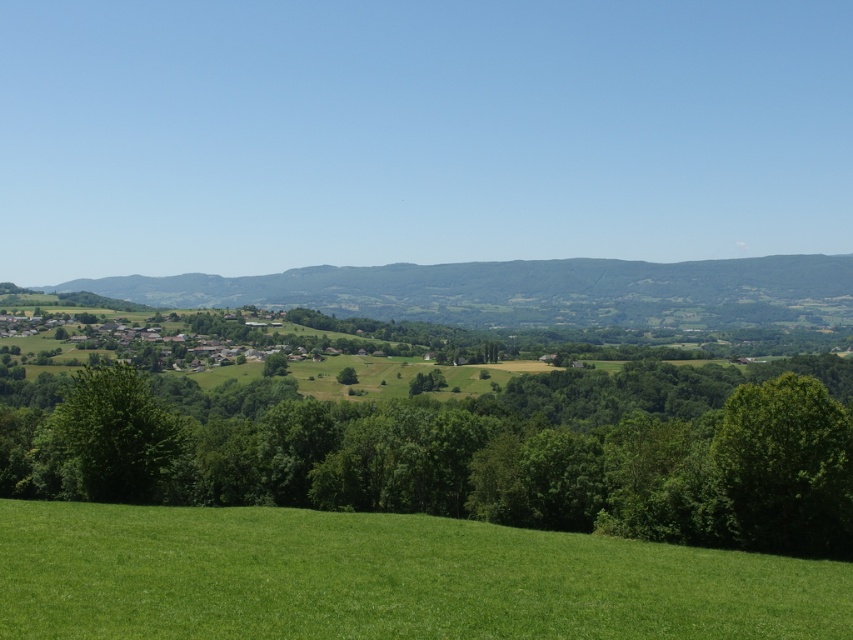
Question: Is green grassy field at lower center further to the viewer compared to green leafy tree at right?

Choices:
 (A) yes
 (B) no

Answer: (B)

Question: Is green leafy tree at center bigger than green grassy field at lower center?

Choices:
 (A) yes
 (B) no

Answer: (A)

Question: Is green leafy tree at right to the right of green leafy tree at lower left from the viewer's perspective?

Choices:
 (A) yes
 (B) no

Answer: (A)

Question: Among these points, which one is farthest from the camera?

Choices:
 (A) (614, 396)
 (B) (138, 468)

Answer: (A)

Question: Estimate the real-world distances between objects in this image. Which object is farther from the green leafy tree at lower left?

Choices:
 (A) green grassy field at lower center
 (B) green leafy tree at center

Answer: (B)

Question: Which point appears farthest from the camera in this image?

Choices:
 (A) (695, 400)
 (B) (817, 577)
 (C) (819, 451)

Answer: (A)